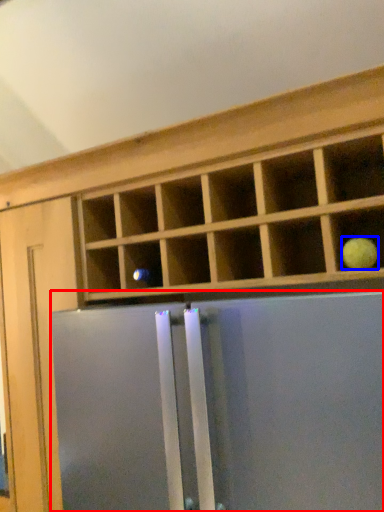
Question: Which of the following is the farthest to the observer, screen door (highlighted by a red box) or fruit (highlighted by a blue box)?

Choices:
 (A) screen door
 (B) fruit

Answer: (B)